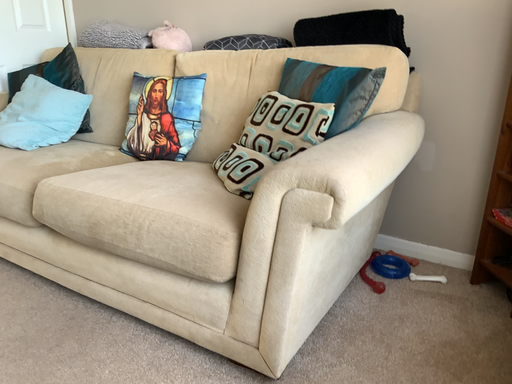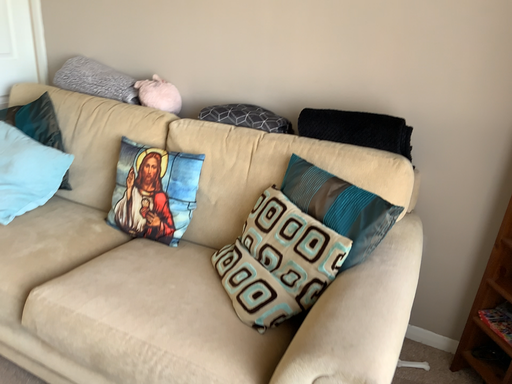
Question: How did the camera likely rotate when shooting the video?

Choices:
 (A) rotated left
 (B) rotated right

Answer: (B)